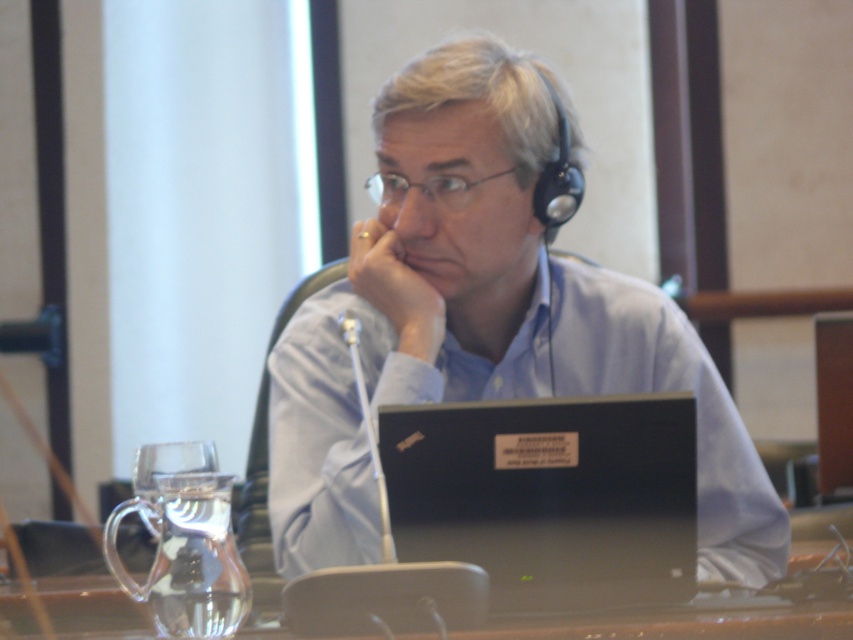
Which is more to the right, transparent glass table at center or clear glass wine glass at lower left?

transparent glass table at center

Does transparent glass table at center have a greater width compared to clear glass wine glass at lower left?

Yes, transparent glass table at center is wider than clear glass wine glass at lower left.

Where is `transparent glass table at center`? This screenshot has width=853, height=640. transparent glass table at center is located at coordinates (693, 620).

Who is higher up, transparent glass table at center or skinny white jaw at center?

skinny white jaw at center

Does point (701, 605) come farther from viewer compared to point (456, 300)?

No, (701, 605) is in front of (456, 300).

Identify the location of transparent glass table at center. click(x=693, y=620).

In the scene shown: Between matte blue shirt at center and black matte laptop at center, which one has more height?

Standing taller between the two is matte blue shirt at center.

Is point (785, 534) farther from camera compared to point (616, 529)?

Yes.

At what (x,y) coordinates should I click in order to perform the action: click on matte blue shirt at center. Please return your answer as a coordinate pair (x, y). The height and width of the screenshot is (640, 853). Looking at the image, I should click on click(x=486, y=326).

The width and height of the screenshot is (853, 640). In order to click on matte blue shirt at center in this screenshot , I will do click(x=486, y=326).